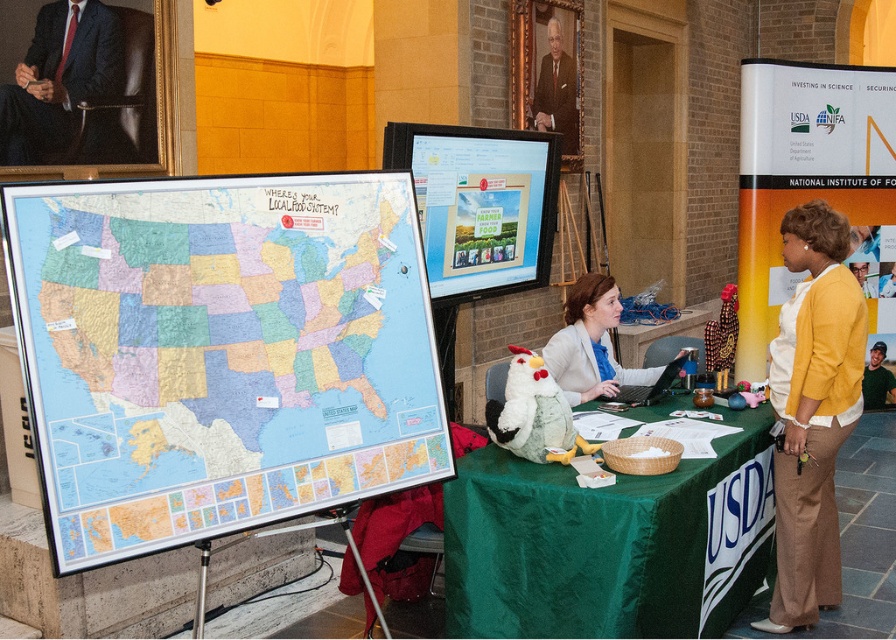
Is point (37, 268) closer to viewer compared to point (726, 586)?

Yes.

Between matte paper map at left and green satin tablecloth at center, which one is positioned higher?

Positioned higher is matte paper map at left.

Does point (255, 488) come closer to viewer compared to point (722, 524)?

That is True.

Locate an element on the screen. This screenshot has width=896, height=640. matte paper map at left is located at coordinates (220, 353).

Is green satin tablecloth at center above dark suit at upper left?

Actually, green satin tablecloth at center is below dark suit at upper left.

Image resolution: width=896 pixels, height=640 pixels. Describe the element at coordinates (609, 544) in the screenshot. I see `green satin tablecloth at center` at that location.

Does point (767, 452) lie behind point (112, 83)?

No, (767, 452) is closer to viewer.

You are a GUI agent. You are given a task and a screenshot of the screen. Output one action in this format:
    pyautogui.click(x=<x>, y=<y>)
    Task: Click on the green satin tablecloth at center
    
    Given the screenshot: What is the action you would take?
    609,544

Between point (608, 339) and point (561, 70), which one is positioned behind?

The point (561, 70) is behind.

Looking at this image, does light beige blazer at center appear on the right side of formal suit at upper center?

Indeed, light beige blazer at center is positioned on the right side of formal suit at upper center.

Which is behind, point (601, 328) or point (563, 93)?

Point (563, 93)

You are a GUI agent. You are given a task and a screenshot of the screen. Output one action in this format:
    pyautogui.click(x=<x>, y=<y>)
    Task: Click on the light beige blazer at center
    This screenshot has width=896, height=640.
    Given the screenshot: What is the action you would take?
    pyautogui.click(x=591, y=342)